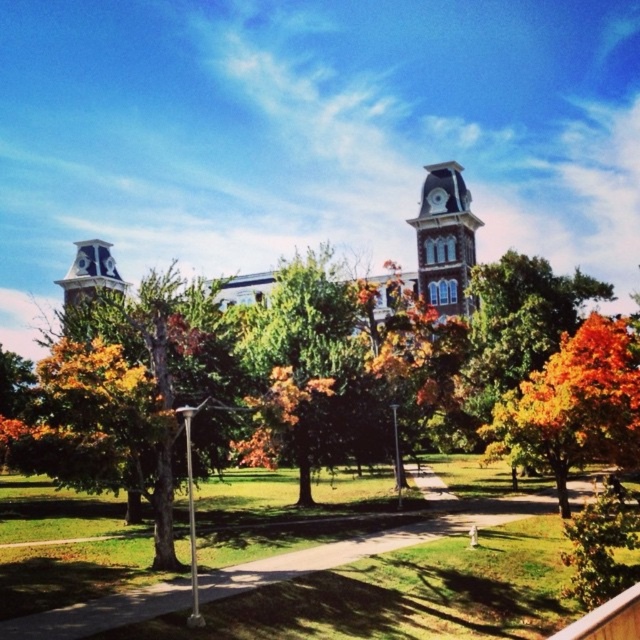
Question: Which object is the closest to the orange leafy tree at center?

Choices:
 (A) brown stone clock tower at upper center
 (B) orange autumn leaves at center
 (C) green grass at lower center
 (D) green leafy tree at center

Answer: (B)

Question: Can you confirm if orange autumn leaves at center is positioned to the right of green grass at lower center?

Choices:
 (A) no
 (B) yes

Answer: (B)

Question: Does green leafy tree at center have a lesser width compared to green grass at lower center?

Choices:
 (A) yes
 (B) no

Answer: (A)

Question: Which of these objects is positioned farthest from the orange leafy tree at center?

Choices:
 (A) brown stone clock tower at upper center
 (B) green leafy tree at center
 (C) green grass at lower center

Answer: (B)

Question: Can you confirm if green leafy tree at center is positioned below orange autumn leaves at center?

Choices:
 (A) no
 (B) yes

Answer: (A)

Question: Among these objects, which one is farthest from the camera?

Choices:
 (A) orange leafy tree at center
 (B) green grass at lower center
 (C) orange autumn leaves at center

Answer: (A)